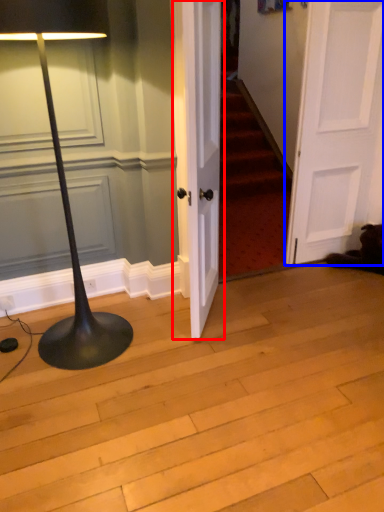
Question: Which object is further to the camera taking this photo, door (highlighted by a red box) or door (highlighted by a blue box)?

Choices:
 (A) door
 (B) door

Answer: (B)